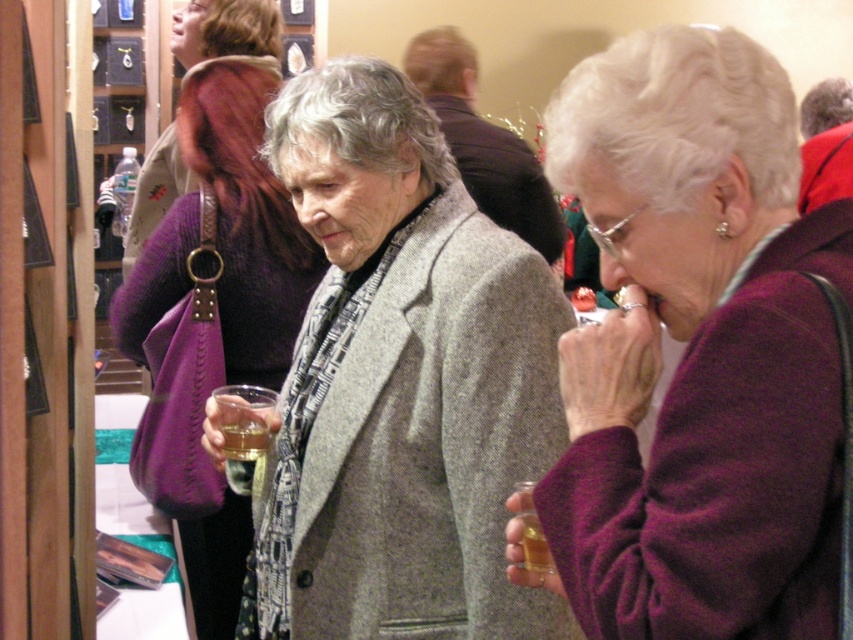
Who is positioned more to the right, purple fabric purse at upper left or translucent glass bottle at lower center?

translucent glass bottle at lower center is more to the right.

Is purple fabric purse at upper left shorter than translucent glass bottle at lower center?

No, purple fabric purse at upper left is not shorter than translucent glass bottle at lower center.

In order to click on purple fabric purse at upper left in this screenshot , I will do `click(227, 33)`.

Is point (718, 605) farther from viewer compared to point (520, 483)?

That is False.

Who is shorter, purple wool sweater at right or translucent glass bottle at lower center?

translucent glass bottle at lower center is shorter.

The width and height of the screenshot is (853, 640). In order to click on purple wool sweater at right in this screenshot , I will do `click(695, 352)`.

At what (x,y) coordinates should I click in order to perform the action: click on purple wool sweater at right. Please return your answer as a coordinate pair (x, y). Looking at the image, I should click on (695, 352).

Is gray woolen coat at center bigger than translucent glass bottle at lower center?

Indeed, gray woolen coat at center has a larger size compared to translucent glass bottle at lower center.

This screenshot has height=640, width=853. What do you see at coordinates (402, 380) in the screenshot?
I see `gray woolen coat at center` at bounding box center [402, 380].

Locate an element on the screen. The image size is (853, 640). gray woolen coat at center is located at coordinates (402, 380).